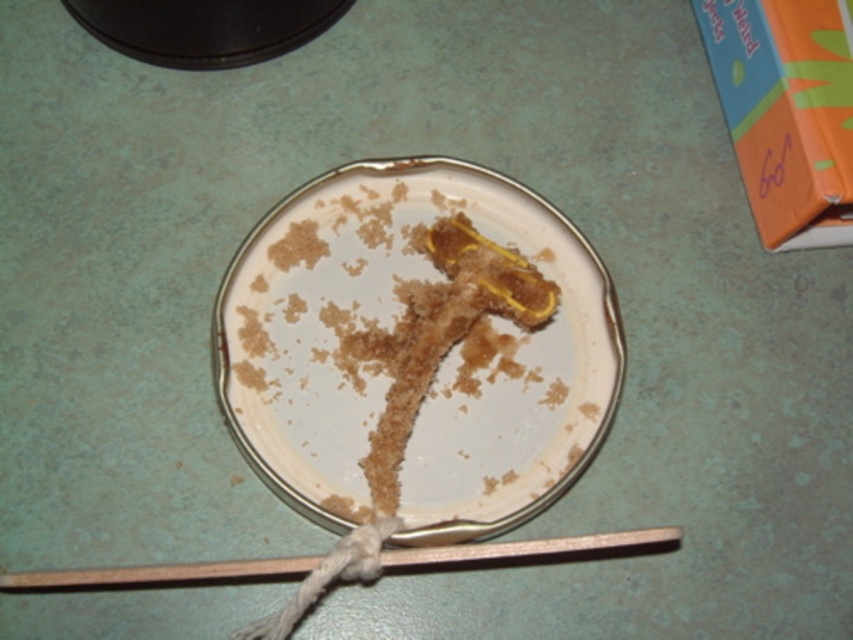
Question: Is white glossy plate at center bigger than wooden chopstick at lower center?

Choices:
 (A) no
 (B) yes

Answer: (B)

Question: Which of the following is the farthest from the observer?

Choices:
 (A) wooden chopstick at lower center
 (B) white glossy plate at center

Answer: (B)

Question: Which point appears closest to the camera in this image?

Choices:
 (A) (257, 250)
 (B) (469, 552)

Answer: (B)

Question: In this image, where is white glossy plate at center located relative to wooden chopstick at lower center?

Choices:
 (A) right
 (B) left

Answer: (A)

Question: Is white glossy plate at center wider than wooden chopstick at lower center?

Choices:
 (A) yes
 (B) no

Answer: (B)